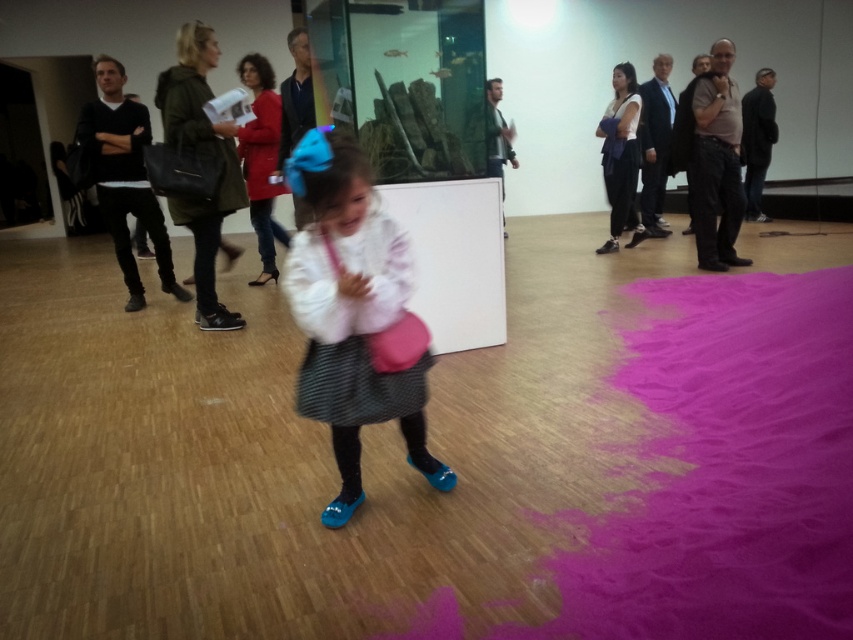
Does green matte jacket at upper left have a smaller size compared to dark gray pants at center?

Indeed, green matte jacket at upper left has a smaller size compared to dark gray pants at center.

Who is positioned more to the right, green matte jacket at upper left or dark gray pants at center?

From the viewer's perspective, dark gray pants at center appears more on the right side.

Between point (194, 221) and point (618, 208), which one is positioned behind?

The point (618, 208) is more distant.

Locate an element on the screen. The height and width of the screenshot is (640, 853). green matte jacket at upper left is located at coordinates (201, 157).

Is black leather jacket at left to the left of dark gray pants at center from the viewer's perspective?

Correct, you'll find black leather jacket at left to the left of dark gray pants at center.

Who is more forward, (136, 292) or (610, 186)?

Point (136, 292) is in front.

Which is behind, point (102, 65) or point (633, 93)?

Point (633, 93)

The image size is (853, 640). In order to click on black leather jacket at left in this screenshot , I will do `click(125, 177)`.

Who is positioned more to the right, green matte jacket at upper left or black leather jacket at left?

green matte jacket at upper left

Does green matte jacket at upper left appear under black leather jacket at left?

Yes, green matte jacket at upper left is below black leather jacket at left.

Which is in front, point (173, 129) or point (126, 100)?

Positioned in front is point (173, 129).

Locate an element on the screen. The height and width of the screenshot is (640, 853). green matte jacket at upper left is located at coordinates (201, 157).